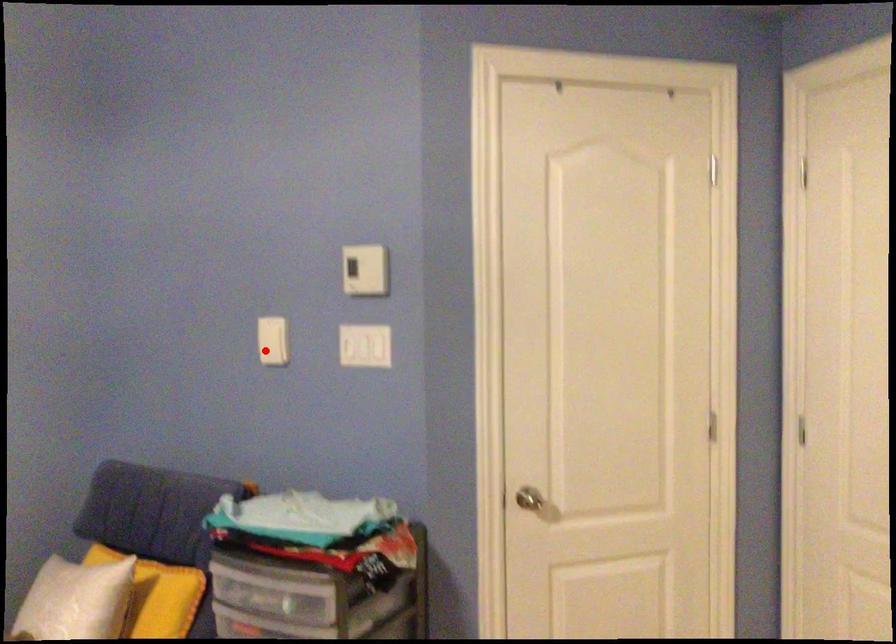
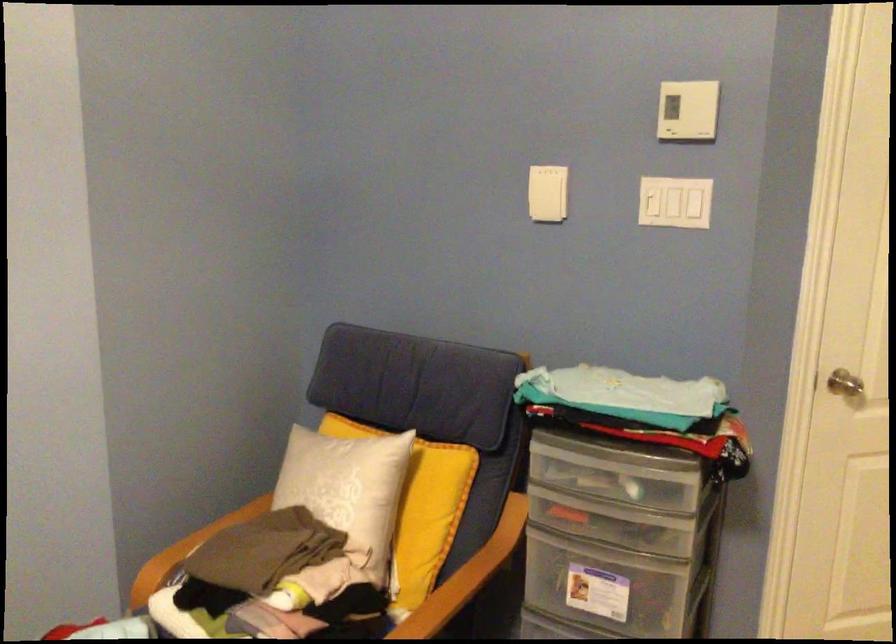
Question: I am providing you with two images of the same scene from different viewpoints. Image1 has a red point marked. In image2, the corresponding 3D location appears at what relative position? Reply with the corresponding letter.

Choices:
 (A) Closer
 (B) Farther

Answer: (A)